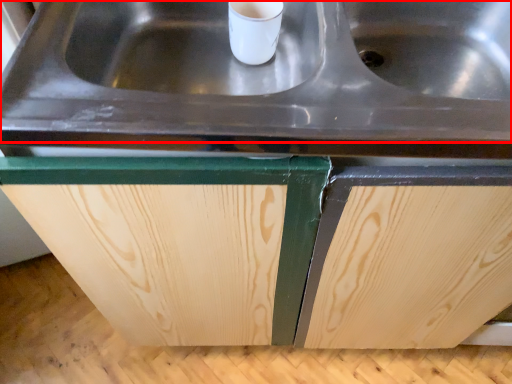
Question: In this image, where is sink (annotated by the red box) located relative to cabinetry?

Choices:
 (A) left
 (B) right

Answer: (B)